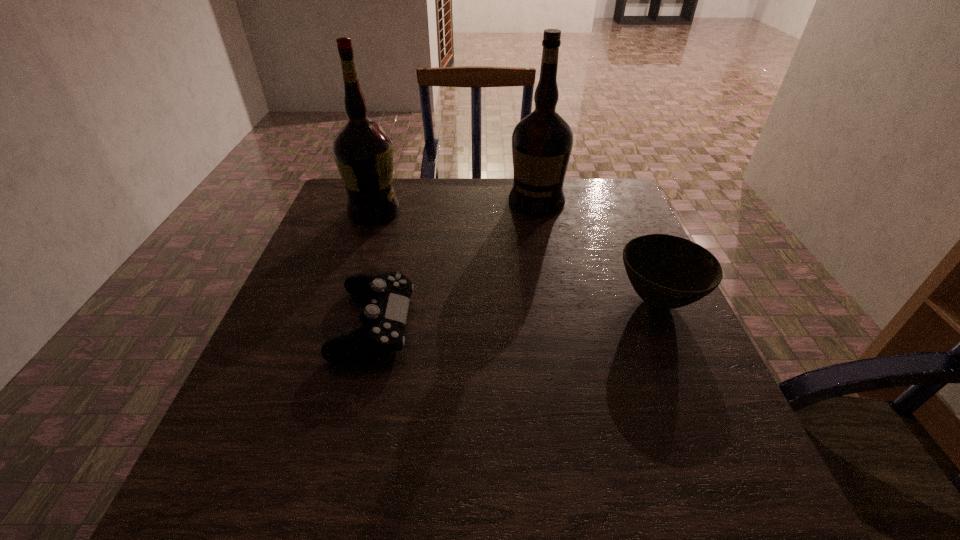
The width and height of the screenshot is (960, 540). I want to click on free space between the control and the liquor, so click(x=455, y=262).

This screenshot has height=540, width=960. What are the coordinates of `empty space that is in between the third object from left to right and the second shortest object` in the screenshot? It's located at (597, 251).

Identify the location of vacant point located between the shortest object and the bowl. (516, 312).

Image resolution: width=960 pixels, height=540 pixels. I want to click on vacant area between the bowl and the third object from left to right, so click(x=597, y=251).

Locate an element on the screen. Image resolution: width=960 pixels, height=540 pixels. object that is the third closest one to the third object from left to right is located at coordinates [384, 318].

Identify which object is the third nearest to the shortest object. Please provide its 2D coordinates. Your answer should be formatted as a tuple, i.e. [(x, y)], where the tuple contains the x and y coordinates of a point satisfying the conditions above.

[(667, 272)]

I want to click on vacant position in the image that satisfies the following two spatial constraints: 1. on the front side of the control; 2. on the surface of the alcohol, so click(338, 323).

Find the location of a particular element. free space that satisfies the following two spatial constraints: 1. on the front side of the alcohol; 2. on the surface of the shortest object is located at coordinates (338, 323).